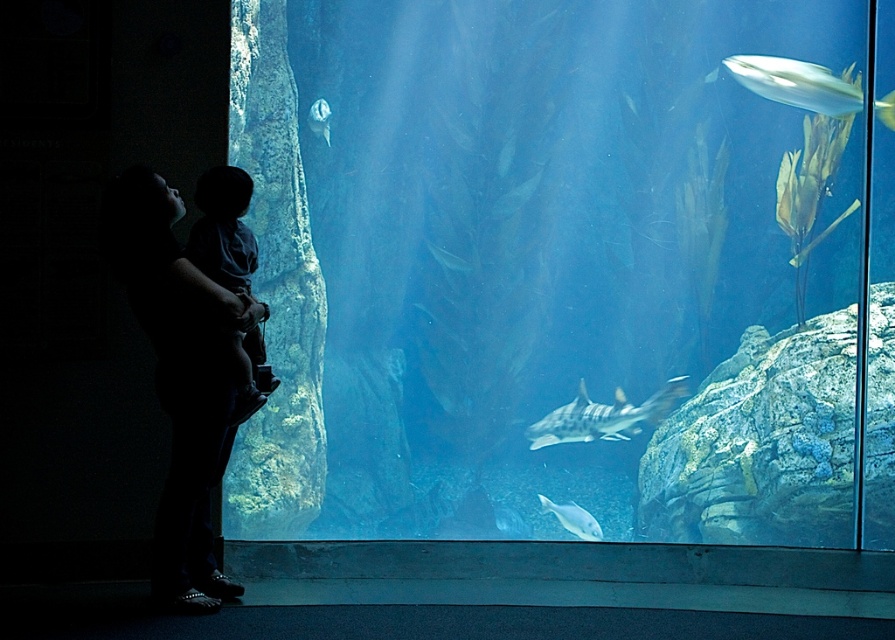
Is shiny silver fish at center behind translucent glass fish at upper center?

No, it is in front of translucent glass fish at upper center.

Does shiny silver fish at center have a lesser height compared to translucent glass fish at upper center?

Yes.

Identify the location of shiny silver fish at center. (573, 518).

Is dark blue fabric at left to the right of translucent glass fish at upper center from the viewer's perspective?

Correct, you'll find dark blue fabric at left to the right of translucent glass fish at upper center.

You are a GUI agent. You are given a task and a screenshot of the screen. Output one action in this format:
    pyautogui.click(x=<x>, y=<y>)
    Task: Click on the dark blue fabric at left
    The height and width of the screenshot is (640, 895).
    Given the screenshot: What is the action you would take?
    [x=223, y=228]

Locate an element on the screen. dark blue fabric at left is located at coordinates (223, 228).

In the scene shown: Does silhouette fabric at left appear under dark blue fabric at left?

Indeed, silhouette fabric at left is positioned under dark blue fabric at left.

Is point (217, 310) closer to viewer compared to point (252, 404)?

Yes, point (217, 310) is in front of point (252, 404).

You are a GUI agent. You are given a task and a screenshot of the screen. Output one action in this format:
    pyautogui.click(x=<x>, y=<y>)
    Task: Click on the silhouette fabric at left
    
    Given the screenshot: What is the action you would take?
    pyautogui.click(x=179, y=378)